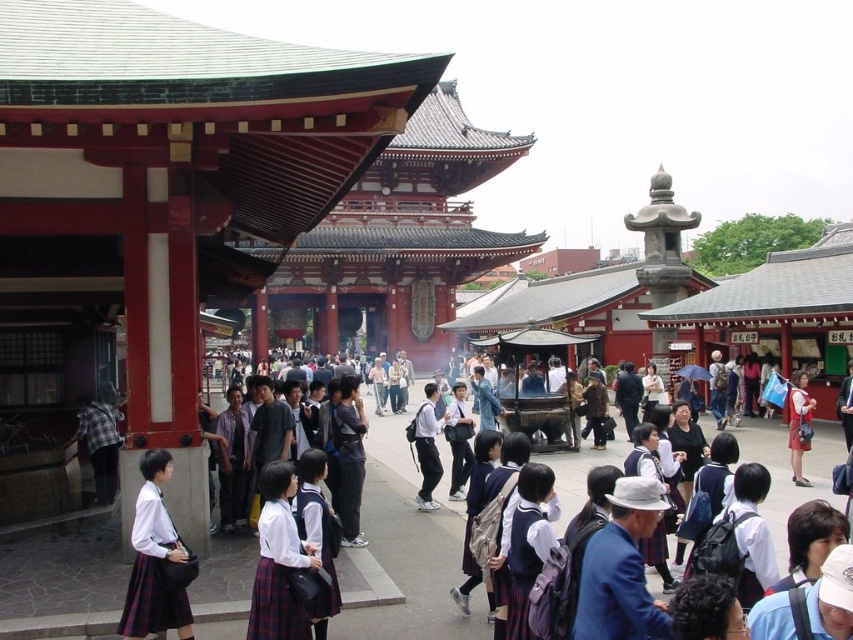
Can you confirm if dark blue uniform at center is positioned to the right of matte blue backpack at center?

Incorrect, dark blue uniform at center is not on the right side of matte blue backpack at center.

Does dark blue uniform at center appear under matte blue backpack at center?

Correct, dark blue uniform at center is located below matte blue backpack at center.

Is point (341, 488) positioned behind point (793, 385)?

No, (341, 488) is closer to viewer.

Locate an element on the screen. The image size is (853, 640). dark blue uniform at center is located at coordinates (349, 458).

Can you confirm if white school uniform at center is positioned to the right of matte blue backpack at center?

In fact, white school uniform at center is to the left of matte blue backpack at center.

You are a GUI agent. You are given a task and a screenshot of the screen. Output one action in this format:
    pyautogui.click(x=<x>, y=<y>)
    Task: Click on the white school uniform at center
    The image size is (853, 640).
    Given the screenshot: What is the action you would take?
    (154, 560)

This screenshot has height=640, width=853. In order to click on white school uniform at center in this screenshot , I will do `click(154, 560)`.

Where is `white school uniform at center`? This screenshot has height=640, width=853. white school uniform at center is located at coordinates (154, 560).

Is matte blue backpack at center shorter than white cotton shirt at center?

No.

Can you confirm if matte blue backpack at center is bigger than white cotton shirt at center?

Correct, matte blue backpack at center is larger in size than white cotton shirt at center.

Does point (798, 449) lie in front of point (643, 396)?

That is True.

At what (x,y) coordinates should I click in order to perform the action: click on matte blue backpack at center. Please return your answer as a coordinate pair (x, y). This screenshot has height=640, width=853. Looking at the image, I should click on (798, 422).